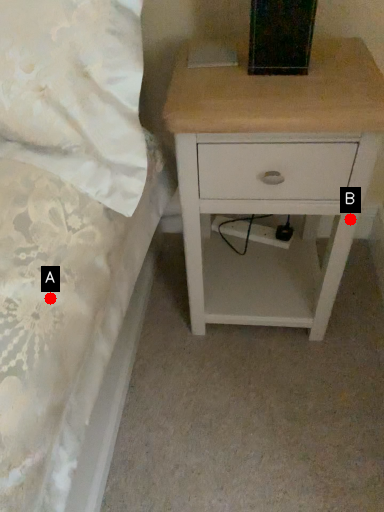
Question: Two points are circled on the image, labeled by A and B beside each circle. Which of the following is the closest to the observer?

Choices:
 (A) A is closer
 (B) B is closer

Answer: (A)